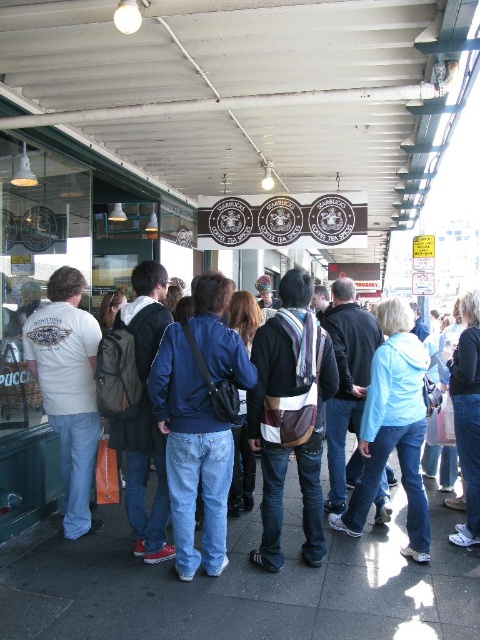
Is blue denim jeans at center taller than white t-shirt at left?

In fact, blue denim jeans at center may be shorter than white t-shirt at left.

Does blue denim jeans at center have a greater width compared to white t-shirt at left?

Indeed, blue denim jeans at center has a greater width compared to white t-shirt at left.

Find the location of a particular element. blue denim jeans at center is located at coordinates (192, 454).